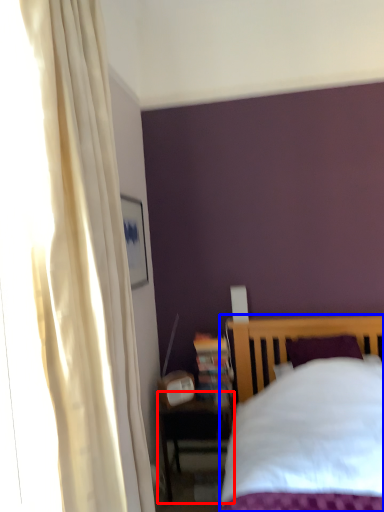
Question: Which object appears farthest to the camera in this image, nightstand (highlighted by a red box) or bed (highlighted by a blue box)?

Choices:
 (A) nightstand
 (B) bed

Answer: (A)